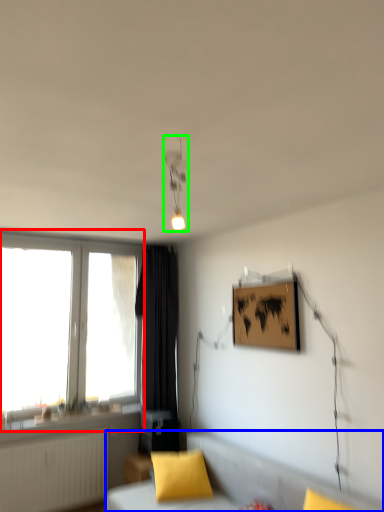
Question: Which object is the closest to the window (highlighted by a red box)? Choose among these: furniture (highlighted by a blue box) or light fixture (highlighted by a green box).

Choices:
 (A) furniture
 (B) light fixture

Answer: (A)